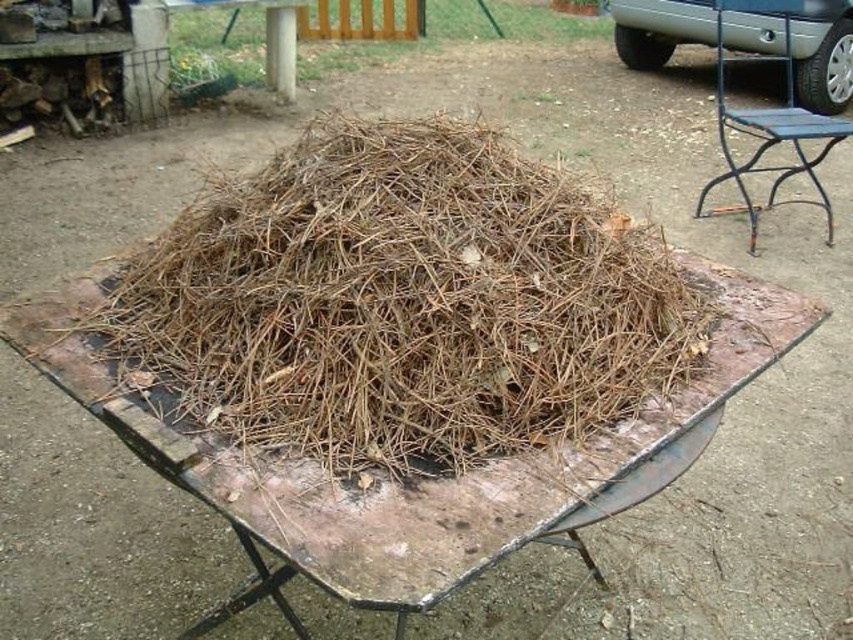
You are trying to move the brown dry hay at center to the compost bin located behind the black metal chair at right. Based on their positions, can you directly move the hay without moving the chair first?

The brown dry hay at center is located below the black metal chair at right, so you would need to move the chair first before accessing the hay.

You are trying to determine if the brown dry hay at center can be placed on top of the black metal chair at right without falling off. Based on their heights, can you confirm if this is possible?

The brown dry hay at center has a lesser height compared to black metal chair at right, so it can be placed on top of the black metal chair at right without falling off since it is shorter and more stable.